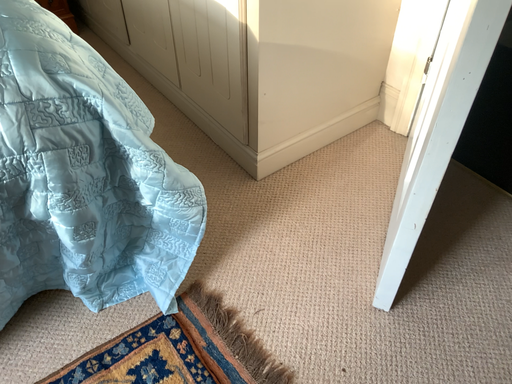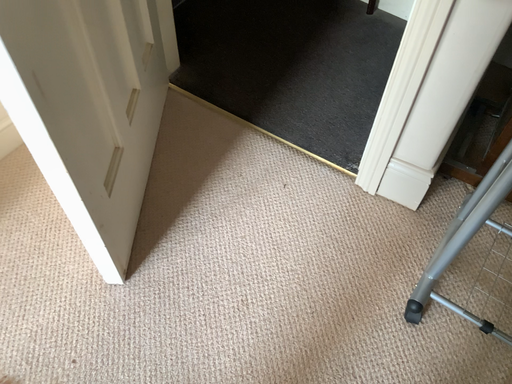
Question: Which way did the camera rotate in the video?

Choices:
 (A) rotated downward
 (B) rotated upward

Answer: (A)